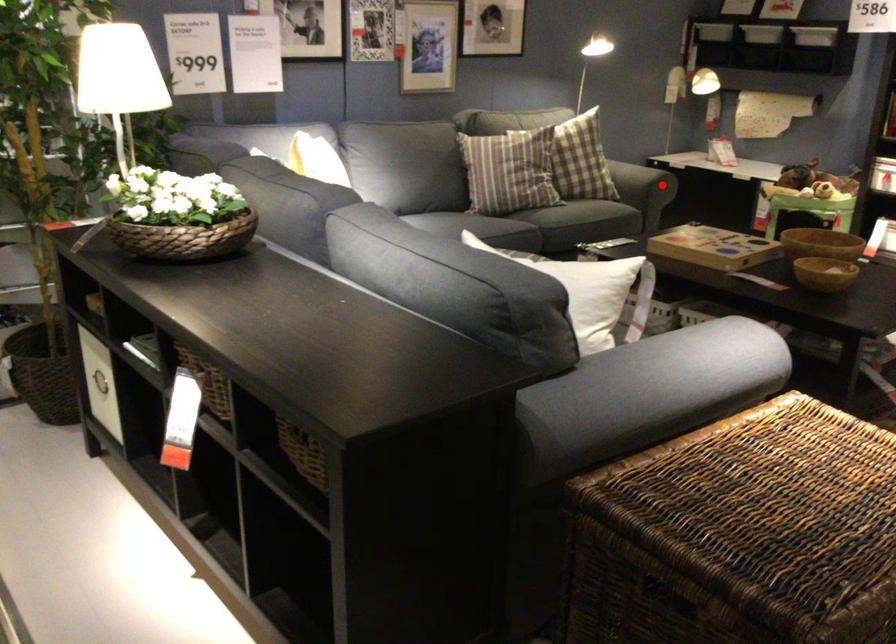
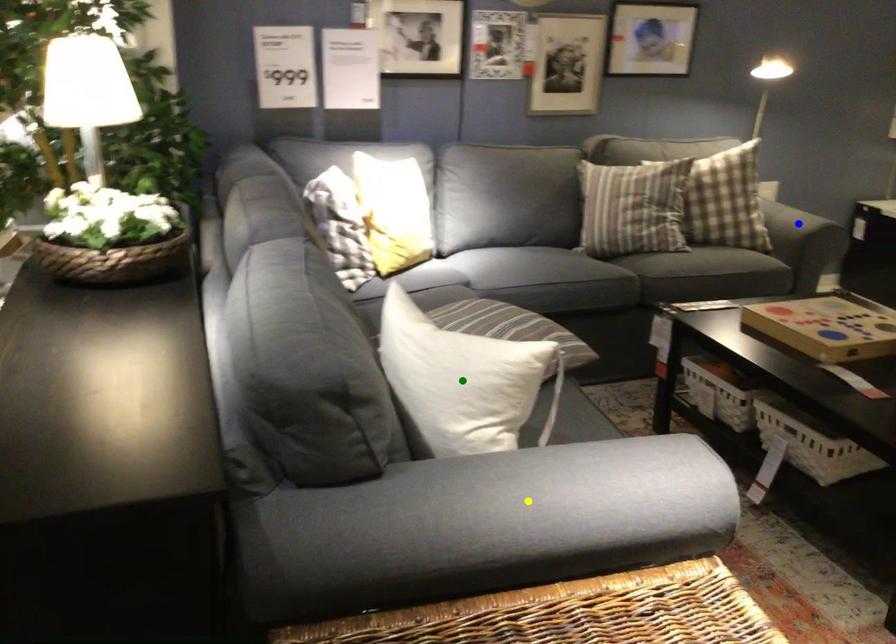
Question: I am providing you with two images of the same scene from different viewpoints. A red point is marked on the first image. You are given multiple points on the second image. Which spot in image 2 lines up with the point in image 1?

Choices:
 (A) yellow point
 (B) green point
 (C) blue point

Answer: (C)